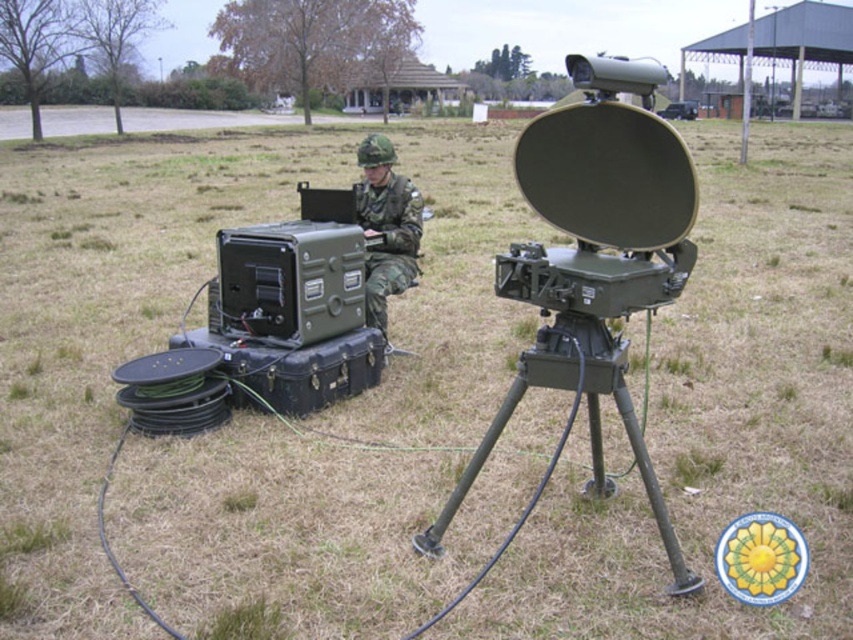
Question: Where is green matte tripod at center located in relation to camouflage fabric uniform at center in the image?

Choices:
 (A) below
 (B) above

Answer: (A)

Question: Which point is closer to the camera?

Choices:
 (A) (408, 243)
 (B) (572, 364)

Answer: (B)

Question: Does green matte tripod at center come behind camouflage fabric uniform at center?

Choices:
 (A) no
 (B) yes

Answer: (A)

Question: Does green matte tripod at center appear on the left side of camouflage fabric uniform at center?

Choices:
 (A) no
 (B) yes

Answer: (A)